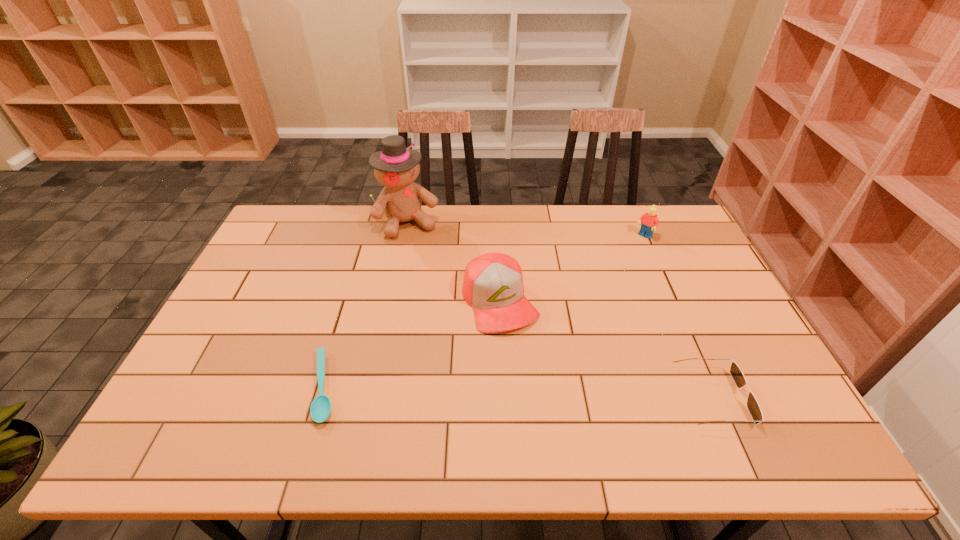
At what (x,y) coordinates should I click in order to perform the action: click on vacant space on the desktop that is between the spoon and the sunglasses and is positioned on the front-facing side of the third nearest object. Please return your answer as a coordinate pair (x, y). The height and width of the screenshot is (540, 960). Looking at the image, I should click on (547, 393).

What are the coordinates of `vacant space on the desktop that is between the shortest object and the second shortest object and is positioned on the face of the Lego` in the screenshot? It's located at (490, 392).

Find the location of `free spot on the desktop that is between the shortest object and the fourth tallest object and is positioned on the front-facing side of the rag_doll`. free spot on the desktop that is between the shortest object and the fourth tallest object and is positioned on the front-facing side of the rag_doll is located at coordinates (497, 392).